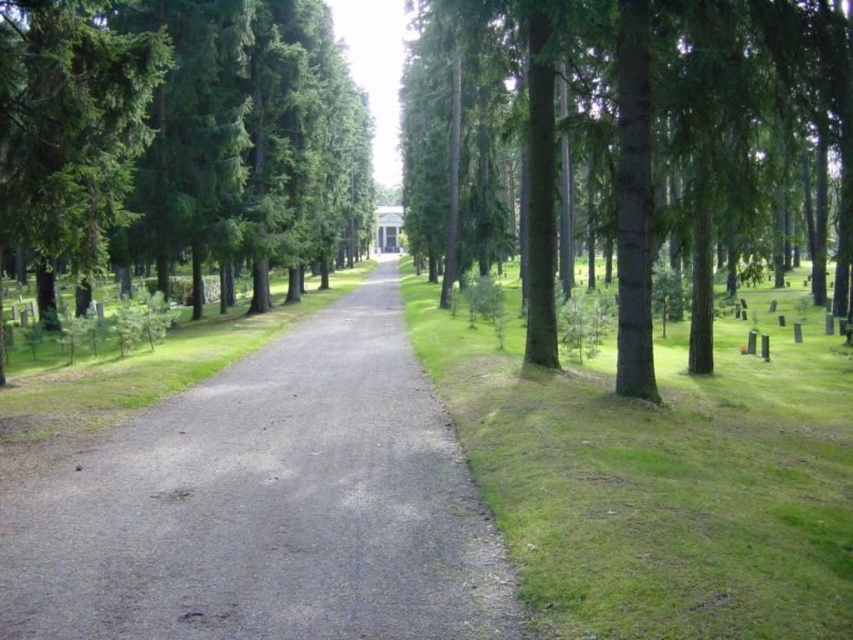
Question: Among these points, which one is farthest from the camera?

Choices:
 (A) (576, 531)
 (B) (549, 113)

Answer: (B)

Question: From the image, what is the correct spatial relationship of green grass at right in relation to green matte tree at left?

Choices:
 (A) left
 (B) right

Answer: (B)

Question: Which is nearer to the green grass at right?

Choices:
 (A) green smooth tree at upper center
 (B) gray gravel path at center

Answer: (B)

Question: Considering the relative positions of green grass at right and green matte tree at left in the image provided, where is green grass at right located with respect to green matte tree at left?

Choices:
 (A) left
 (B) right

Answer: (B)

Question: Observing the image, what is the correct spatial positioning of gray gravel path at center in reference to green grass at right?

Choices:
 (A) above
 (B) below

Answer: (B)

Question: Among these points, which one is nearest to the camera?

Choices:
 (A) (138, 595)
 (B) (730, 600)
 (C) (28, 225)

Answer: (B)